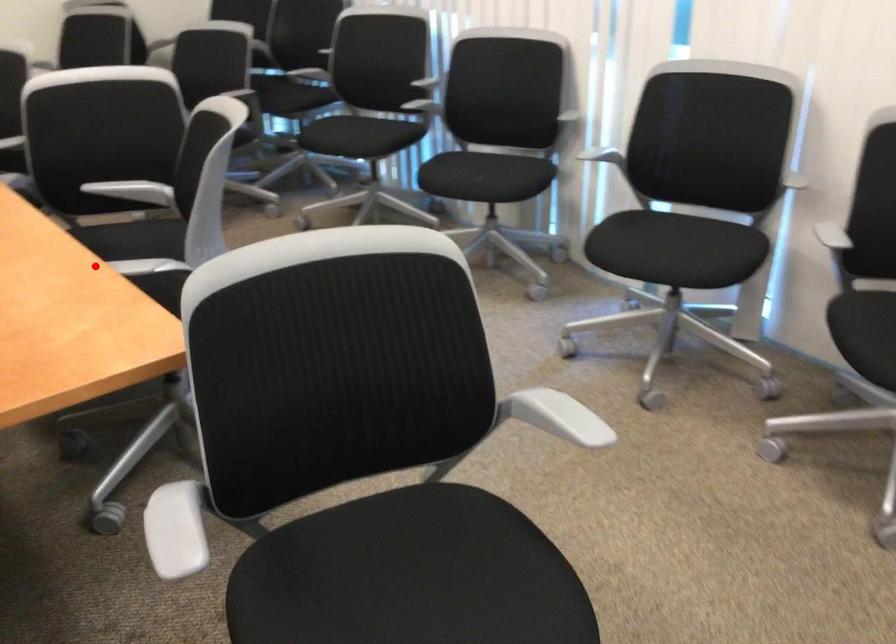
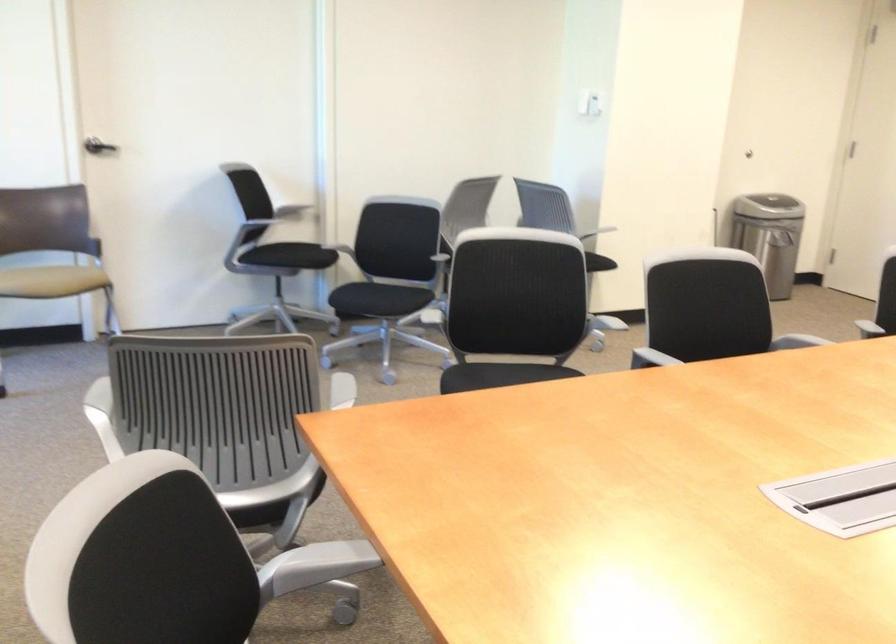
Locate, in the second image, the point that corresponds to the highlighted location in the first image.

(320, 562)